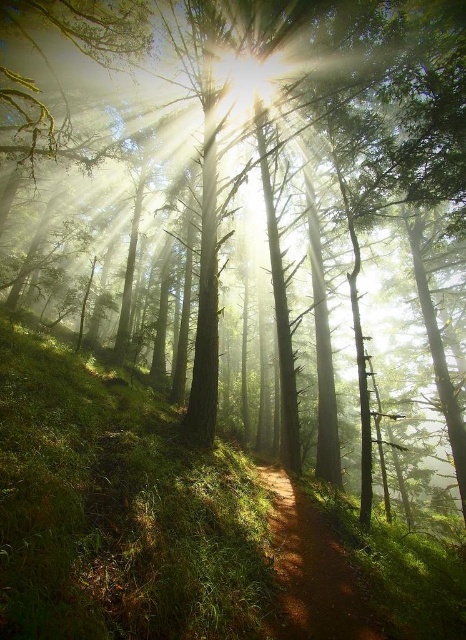
Question: Among these points, which one is farthest from the camera?

Choices:
 (A) (262, 81)
 (B) (297, 502)

Answer: (A)

Question: Is dirt path at center smaller than bright white light at center?

Choices:
 (A) no
 (B) yes

Answer: (B)

Question: In this image, where is dirt path at center located relative to bright white light at center?

Choices:
 (A) left
 (B) right

Answer: (B)

Question: Which point is farther to the camera?

Choices:
 (A) (320, 538)
 (B) (237, 76)

Answer: (B)

Question: Which of the following is the farthest from the observer?

Choices:
 (A) (289, 499)
 (B) (231, 88)

Answer: (B)

Question: Is dirt path at center above bright white light at center?

Choices:
 (A) yes
 (B) no

Answer: (B)